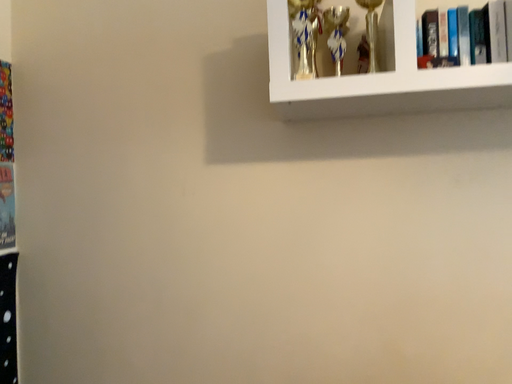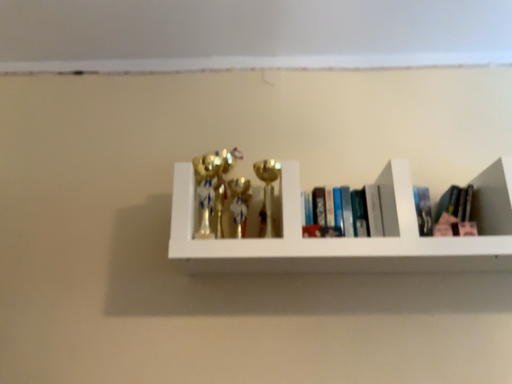
Question: How did the camera likely rotate when shooting the video?

Choices:
 (A) rotated downward
 (B) rotated upward

Answer: (B)